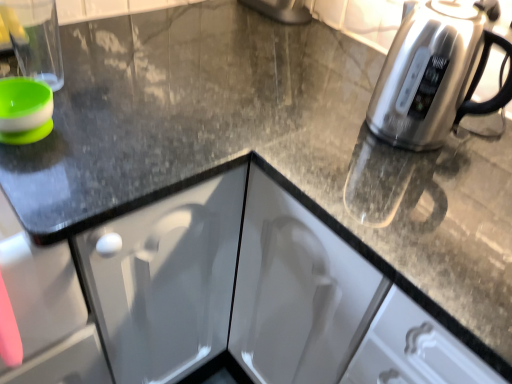
The image size is (512, 384). What are the coordinates of `free location to the right of satin silver kettle at right` in the screenshot? It's located at (484, 145).